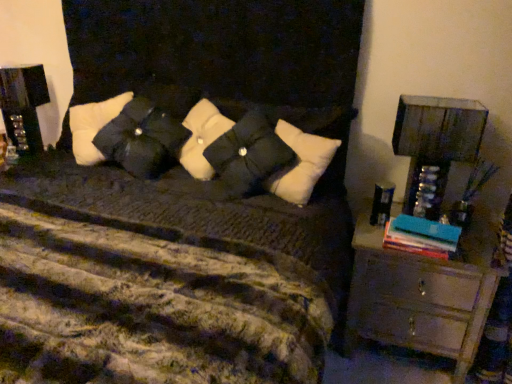
Question: Is black glossy speaker at left inside or outside of black matte pillow at center?

Choices:
 (A) inside
 (B) outside

Answer: (B)

Question: In terms of width, does black glossy speaker at left look wider or thinner when compared to black matte pillow at center?

Choices:
 (A) wide
 (B) thin

Answer: (B)

Question: Which is nearer to the wooden chest of drawers at right?

Choices:
 (A) black glossy speaker at left
 (B) black matte pillow at center
 (C) teal matte book at right

Answer: (C)

Question: Based on their relative distances, which object is nearer to the black matte pillow at center?

Choices:
 (A) wooden chest of drawers at right
 (B) black glossy speaker at left
 (C) teal matte book at right

Answer: (B)